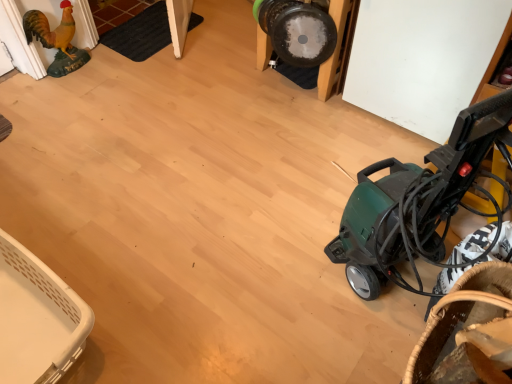
Find the location of a particular element. This screenshot has width=512, height=384. vacant area to the right of golden matte chicken at left is located at coordinates (100, 72).